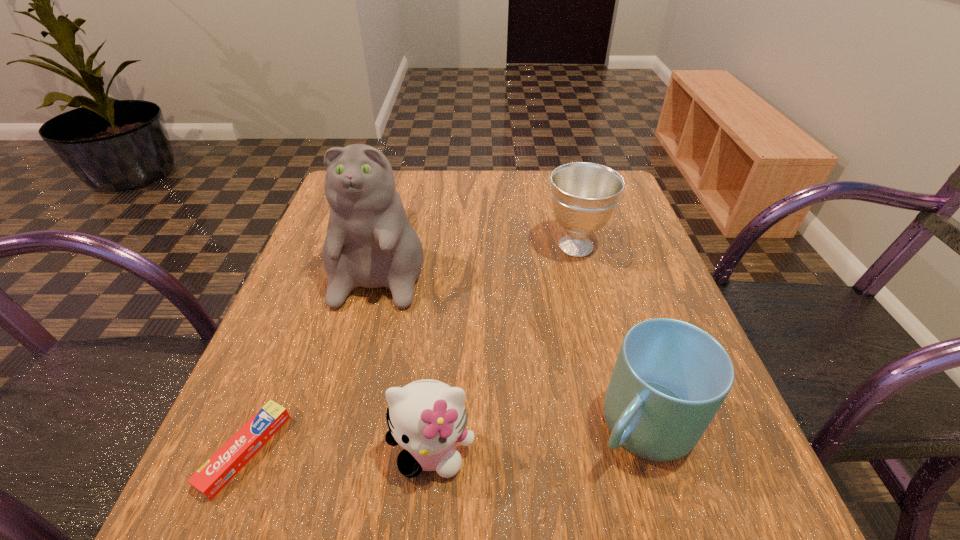
I want to click on object situated at the near right corner, so click(670, 378).

The height and width of the screenshot is (540, 960). In the image, there is a desktop. Identify the location of free space at the far edge. (441, 201).

The width and height of the screenshot is (960, 540). Find the location of `vacant space at the near edge of the desktop`. vacant space at the near edge of the desktop is located at coordinates (579, 520).

Where is `free region at the left edge of the desktop`? free region at the left edge of the desktop is located at coordinates (277, 327).

The width and height of the screenshot is (960, 540). In order to click on free space at the right edge of the desktop in this screenshot , I will do pos(719,426).

Image resolution: width=960 pixels, height=540 pixels. Find the location of `vacant space at the near left corner of the desktop`. vacant space at the near left corner of the desktop is located at coordinates (213, 531).

In the image, there is a desktop. Where is `vacant space at the far right corner`? The height and width of the screenshot is (540, 960). vacant space at the far right corner is located at coordinates (619, 217).

Locate an element on the screen. vacant space that is in between the kitten and the cat is located at coordinates (407, 353).

This screenshot has height=540, width=960. What are the coordinates of `vacant space in between the chalice and the tallest object` in the screenshot? It's located at (479, 250).

The width and height of the screenshot is (960, 540). Identify the location of free space between the tallest object and the kitten. (407, 353).